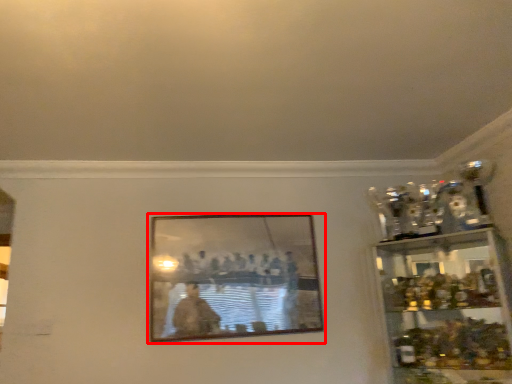
Question: Where is picture frame (annotated by the red box) located in relation to shelf in the image?

Choices:
 (A) right
 (B) left

Answer: (B)